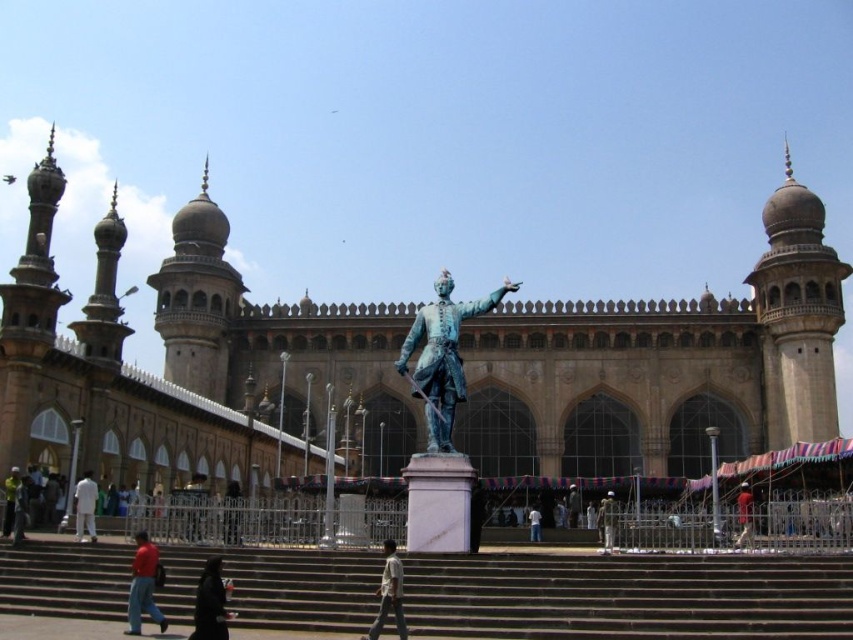
Question: Which point appears closest to the camera in this image?

Choices:
 (A) (4, 512)
 (B) (218, 636)
 (C) (601, 534)
 (D) (129, 598)

Answer: (B)

Question: Among these objects, which one is nearest to the camera?

Choices:
 (A) green patinated bronze statue at center
 (B) light blue fabric at center
 (C) dark brown coat at lower center
 (D) white cotton pants at lower left

Answer: (C)

Question: Does green patinated bronze statue at center appear over red shirt at lower left?

Choices:
 (A) yes
 (B) no

Answer: (A)

Question: Which object appears farthest from the camera in this image?

Choices:
 (A) light blue fabric at center
 (B) dark brown coat at lower center

Answer: (A)

Question: From the image, what is the correct spatial relationship of beige stone mosque at center in relation to light brown leather jacket at lower left?

Choices:
 (A) right
 (B) left

Answer: (A)

Question: Can you confirm if dark brown coat at lower center is positioned to the left of light blue fabric at center?

Choices:
 (A) no
 (B) yes

Answer: (B)